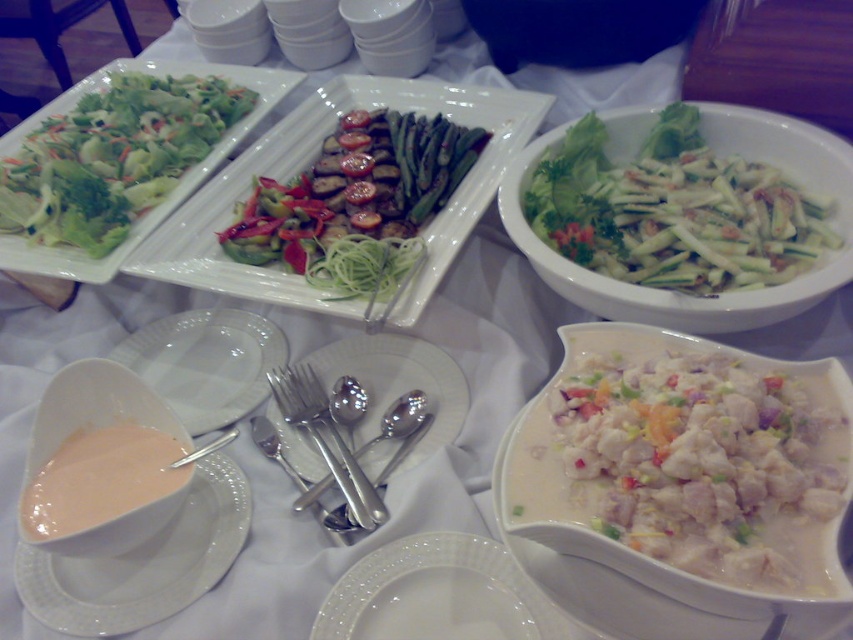
You are a chef arranging a table for a dinner party. You have a green matte salad bowl at center and a green matte salad at center. Which item has a greater width?

The green matte salad bowl at center has a greater width than the green matte salad at center, as the bowl is wider than the salad inside it.

You are a guest at the table and want to reach for the green matte salad bowl at center without moving the silver metallic spoon at center. Which direction should you move your hand relative to the spoon?

The green matte salad bowl at center is to the right of the silver metallic spoon at center, so you should move your hand to the right of the spoon to reach it without disturbing the spoon.

You are a chef arranging a table for a dinner party. You have a green matte salad bowl at center and a green matte salad at center. How far apart should you place them to match the image?

The green matte salad bowl at center should be placed 9.78 inches away from the green matte salad at center to match the image.